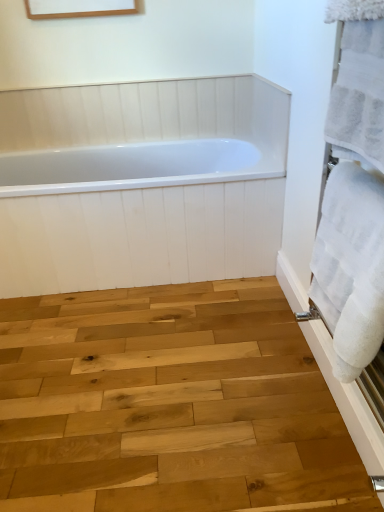
I want to click on vacant space underneath white soft towel at right, arranged as the first bath towel when ordered from the bottom (from a real-world perspective), so click(321, 445).